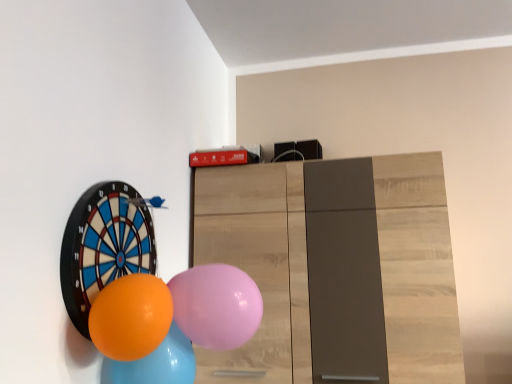
Describe the element at coordinates (103, 246) in the screenshot. I see `orange rubber balloon at left, the fourth balloon from the right` at that location.

The image size is (512, 384). Find the location of `orange rubber balloon at left, the 1th balloon in the left-to-right sequence`. orange rubber balloon at left, the 1th balloon in the left-to-right sequence is located at coordinates (103, 246).

Is orange rubber balloon at left, the 1th balloon in the left-to-right sequence, positioned in front of pink rubber balloon at center, which is the 1th balloon in right-to-left order?

Yes.

At what (x,y) coordinates should I click in order to perform the action: click on the 3rd balloon counting from the left of the pink rubber balloon at center, which is the 1th balloon in right-to-left order. Please return your answer as a coordinate pair (x, y). This screenshot has width=512, height=384. Looking at the image, I should click on (103, 246).

From a real-world perspective, who is located lower, orange rubber balloon at left, the fourth balloon from the right, or pink rubber balloon at center, which is the 1th balloon in right-to-left order?

pink rubber balloon at center, which is the 1th balloon in right-to-left order.

Could you tell me if orange rubber balloon at left, the fourth balloon from the right, is turned towards pink rubber balloon at center, the fourth balloon viewed from the left?

Yes, orange rubber balloon at left, the fourth balloon from the right, faces towards pink rubber balloon at center, the fourth balloon viewed from the left.

Does point (102, 343) lie behind point (219, 314)?

No.

Considering the sizes of objects orange glossy balloon at lower left, the 3th balloon viewed from the left, and pink rubber balloon at center, which is the 1th balloon in right-to-left order, in the image provided, who is smaller, orange glossy balloon at lower left, the 3th balloon viewed from the left, or pink rubber balloon at center, which is the 1th balloon in right-to-left order,?

orange glossy balloon at lower left, the 3th balloon viewed from the left, is smaller.

From a real-world perspective, starting from the orange glossy balloon at lower left, which is the 2th balloon in right-to-left order, which balloon is the 1st one vertically above it? Please provide its 2D coordinates.

[(216, 305)]

Considering their positions, is orange glossy balloon at lower left, which is the 2th balloon in right-to-left order, located in front of or behind pink rubber balloon at center, the fourth balloon viewed from the left?

orange glossy balloon at lower left, which is the 2th balloon in right-to-left order, is positioned closer to the viewer than pink rubber balloon at center, the fourth balloon viewed from the left.

Is point (84, 254) less distant than point (191, 358)?

Yes, point (84, 254) is in front of point (191, 358).

In terms of height, does orange rubber balloon at left, the fourth balloon from the right, look taller or shorter compared to orange glossy balloon at lower left, arranged as the third balloon when viewed from the right?

In the image, orange rubber balloon at left, the fourth balloon from the right, appears to be taller than orange glossy balloon at lower left, arranged as the third balloon when viewed from the right.

Is orange glossy balloon at lower left, which is the 2th balloon from left to right, at the back of orange rubber balloon at left, the 1th balloon in the left-to-right sequence?

That's not correct — orange rubber balloon at left, the 1th balloon in the left-to-right sequence, is not looking away from orange glossy balloon at lower left, which is the 2th balloon from left to right.

In the scene shown: Between orange rubber balloon at left, the 1th balloon in the left-to-right sequence, and orange glossy balloon at lower left, which is the 2th balloon from left to right, which one has smaller width?

orange rubber balloon at left, the 1th balloon in the left-to-right sequence.

From the image's perspective, between pink rubber balloon at center, the fourth balloon viewed from the left, and orange rubber balloon at left, the 1th balloon in the left-to-right sequence, who is located below?

pink rubber balloon at center, the fourth balloon viewed from the left, appears lower in the image.

How many degrees apart are the facing directions of pink rubber balloon at center, which is the 1th balloon in right-to-left order, and orange rubber balloon at left, the fourth balloon from the right?

The angle between the facing direction of pink rubber balloon at center, which is the 1th balloon in right-to-left order, and the facing direction of orange rubber balloon at left, the fourth balloon from the right, is 0.000345 degrees.

Is pink rubber balloon at center, which is the 1th balloon in right-to-left order, turned away from orange rubber balloon at left, the fourth balloon from the right?

Yes, pink rubber balloon at center, which is the 1th balloon in right-to-left order,'s orientation is away from orange rubber balloon at left, the fourth balloon from the right.

Does pink rubber balloon at center, the fourth balloon viewed from the left, appear on the left side of orange rubber balloon at left, the 1th balloon in the left-to-right sequence?

Incorrect, pink rubber balloon at center, the fourth balloon viewed from the left, is not on the left side of orange rubber balloon at left, the 1th balloon in the left-to-right sequence.

From the image's perspective, which object appears higher, orange glossy balloon at lower left, arranged as the third balloon when viewed from the right, or orange rubber balloon at left, the fourth balloon from the right?

Result: orange rubber balloon at left, the fourth balloon from the right, appears higher in the image.

Does orange glossy balloon at lower left, arranged as the third balloon when viewed from the right, have a greater height compared to orange rubber balloon at left, the 1th balloon in the left-to-right sequence?

No, orange glossy balloon at lower left, arranged as the third balloon when viewed from the right, is not taller than orange rubber balloon at left, the 1th balloon in the left-to-right sequence.

Is point (187, 367) farther from viewer compared to point (130, 256)?

No, (187, 367) is closer to viewer.

How many degrees apart are the facing directions of orange glossy balloon at lower left, which is the 2th balloon from left to right, and orange rubber balloon at left, the fourth balloon from the right?

There is a 0.000951-degree angle between the facing directions of orange glossy balloon at lower left, which is the 2th balloon from left to right, and orange rubber balloon at left, the fourth balloon from the right.

Between orange glossy balloon at lower left, which is the 2th balloon in right-to-left order, and orange rubber balloon at left, the fourth balloon from the right, which one has larger size?

orange rubber balloon at left, the fourth balloon from the right.

Based on the photo, can you tell me how much orange glossy balloon at lower left, which is the 2th balloon in right-to-left order, and orange rubber balloon at left, the 1th balloon in the left-to-right sequence, differ in facing direction?

They differ by 0.000324 degrees in their facing directions.

Considering the relative sizes of orange glossy balloon at lower left, the 3th balloon viewed from the left, and orange rubber balloon at left, the 1th balloon in the left-to-right sequence, in the image provided, is orange glossy balloon at lower left, the 3th balloon viewed from the left, thinner than orange rubber balloon at left, the 1th balloon in the left-to-right sequence,?

Incorrect, the width of orange glossy balloon at lower left, the 3th balloon viewed from the left, is not less than that of orange rubber balloon at left, the 1th balloon in the left-to-right sequence.

Is pink rubber balloon at center, the fourth balloon viewed from the left, facing towards orange glossy balloon at lower left, which is the 2th balloon from left to right?

No, pink rubber balloon at center, the fourth balloon viewed from the left, does not turn towards orange glossy balloon at lower left, which is the 2th balloon from left to right.

Would you say pink rubber balloon at center, which is the 1th balloon in right-to-left order, contains orange glossy balloon at lower left, arranged as the third balloon when viewed from the right?

No, orange glossy balloon at lower left, arranged as the third balloon when viewed from the right, is not inside pink rubber balloon at center, which is the 1th balloon in right-to-left order.

From a real-world perspective, which is physically above, pink rubber balloon at center, the fourth balloon viewed from the left, or orange glossy balloon at lower left, arranged as the third balloon when viewed from the right?

From a 3D spatial view, pink rubber balloon at center, the fourth balloon viewed from the left, is above.

Is pink rubber balloon at center, which is the 1th balloon in right-to-left order, in front of or behind orange glossy balloon at lower left, arranged as the third balloon when viewed from the right, in the image?

pink rubber balloon at center, which is the 1th balloon in right-to-left order, is positioned closer to the viewer than orange glossy balloon at lower left, arranged as the third balloon when viewed from the right.

Where is `balloon that is above the pink rubber balloon at center, which is the 1th balloon in right-to-left order (from the image's perspective)`? This screenshot has width=512, height=384. balloon that is above the pink rubber balloon at center, which is the 1th balloon in right-to-left order (from the image's perspective) is located at coordinates (103, 246).

From the orange glossy balloon at lower left, the 3th balloon viewed from the left, count 2nd balloons backward and point to it. Please provide its 2D coordinates.

[(216, 305)]

Considering their positions, is orange glossy balloon at lower left, arranged as the third balloon when viewed from the right, positioned further to orange glossy balloon at lower left, the 3th balloon viewed from the left, than orange rubber balloon at left, the fourth balloon from the right?

orange rubber balloon at left, the fourth balloon from the right.

Based on their spatial positions, is orange rubber balloon at left, the 1th balloon in the left-to-right sequence, or pink rubber balloon at center, which is the 1th balloon in right-to-left order, further from orange glossy balloon at lower left, arranged as the third balloon when viewed from the right?

orange rubber balloon at left, the 1th balloon in the left-to-right sequence, is positioned further to the anchor orange glossy balloon at lower left, arranged as the third balloon when viewed from the right.

Based on their spatial positions, is orange rubber balloon at left, the fourth balloon from the right, or orange glossy balloon at lower left, the 3th balloon viewed from the left, further from pink rubber balloon at center, the fourth balloon viewed from the left?

orange rubber balloon at left, the fourth balloon from the right, is further to pink rubber balloon at center, the fourth balloon viewed from the left.

Looking at the image, which one is located further to pink rubber balloon at center, the fourth balloon viewed from the left, orange rubber balloon at left, the fourth balloon from the right, or orange glossy balloon at lower left, arranged as the third balloon when viewed from the right?

The object further to pink rubber balloon at center, the fourth balloon viewed from the left, is orange rubber balloon at left, the fourth balloon from the right.

When comparing their distances from pink rubber balloon at center, which is the 1th balloon in right-to-left order, does orange glossy balloon at lower left, which is the 2th balloon in right-to-left order, or orange glossy balloon at lower left, which is the 2th balloon from left to right, seem closer?

orange glossy balloon at lower left, which is the 2th balloon from left to right, is closer to pink rubber balloon at center, which is the 1th balloon in right-to-left order.

Based on the photo, which object lies nearer to the anchor point orange rubber balloon at left, the 1th balloon in the left-to-right sequence, orange glossy balloon at lower left, which is the 2th balloon in right-to-left order, or orange glossy balloon at lower left, arranged as the third balloon when viewed from the right?

orange glossy balloon at lower left, which is the 2th balloon in right-to-left order, lies closer to orange rubber balloon at left, the 1th balloon in the left-to-right sequence, than the other object.

Looking at the image, which one is located further to orange glossy balloon at lower left, arranged as the third balloon when viewed from the right, orange glossy balloon at lower left, which is the 2th balloon in right-to-left order, or orange rubber balloon at left, the fourth balloon from the right?

The object further to orange glossy balloon at lower left, arranged as the third balloon when viewed from the right, is orange rubber balloon at left, the fourth balloon from the right.

Looking at the image, which one is located closer to orange glossy balloon at lower left, which is the 2th balloon from left to right, pink rubber balloon at center, which is the 1th balloon in right-to-left order, or orange glossy balloon at lower left, the 3th balloon viewed from the left?

orange glossy balloon at lower left, the 3th balloon viewed from the left, is positioned closer to the anchor orange glossy balloon at lower left, which is the 2th balloon from left to right.

Identify the location of balloon between orange glossy balloon at lower left, which is the 2th balloon from left to right, and pink rubber balloon at center, which is the 1th balloon in right-to-left order. The width and height of the screenshot is (512, 384). (131, 317).